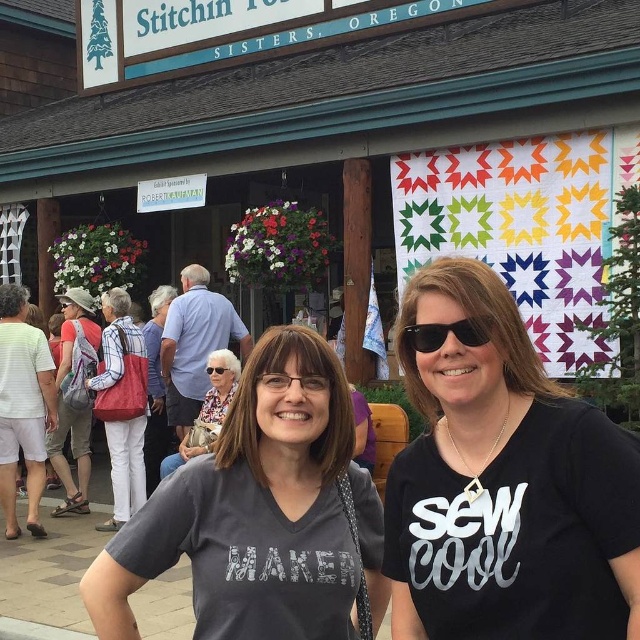
Question: Is the position of matte gray hat at upper left less distant than that of clear plastic glasses at center?

Choices:
 (A) yes
 (B) no

Answer: (B)

Question: Which object is closer to the camera taking this photo?

Choices:
 (A) matte black goggles at center
 (B) black matte t-shirt at center

Answer: (B)

Question: Is black matte t-shirt at center above sunglasses at center?

Choices:
 (A) no
 (B) yes

Answer: (A)

Question: Which point appears farthest from the camera in this image?

Choices:
 (A) (80, 500)
 (B) (144, 328)
 (C) (237, 509)

Answer: (B)

Question: Does matte red bag at center appear on the left side of matte gray hat at upper left?

Choices:
 (A) yes
 (B) no

Answer: (B)

Question: Which object is positioned closest to the matte black goggles at center?

Choices:
 (A) clear plastic glasses at center
 (B) gray matte shirt at center
 (C) transparent plastic goggles at center

Answer: (C)